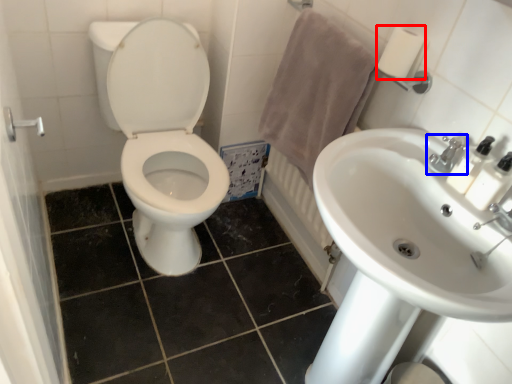
Question: Which point is further to the camera, toilet paper (highlighted by a red box) or tap (highlighted by a blue box)?

Choices:
 (A) toilet paper
 (B) tap

Answer: (A)